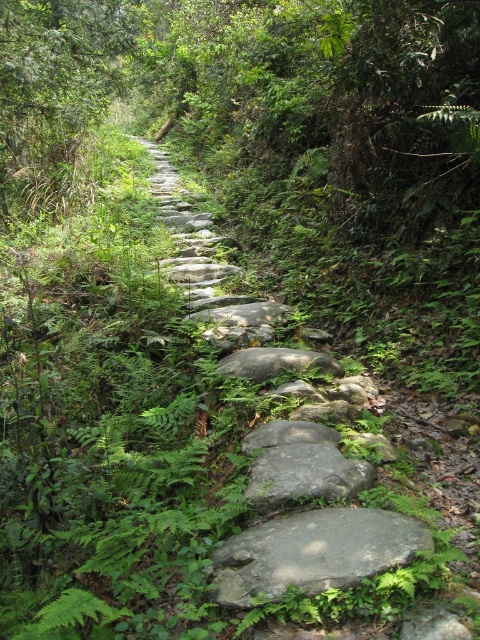
You are hiking along a forest path and come across two gray smooth rocks at the center of the path. One is labeled as the gray smooth rock at center and the other as the gray smooth stone at center. Which one is positioned to the left when viewed from your perspective standing at the start of the path?

The gray smooth rock at center is positioned to the left of the gray smooth stone at center.

You are standing on the forest path and want to reach the point at coordinates point (298, 497). Given that your average walking speed is 1.5 meters per second, how many seconds will it take you to reach the point?

The point (298, 497) is 3.37 meters away from the viewer. At a walking speed of 1.5 meters per second, it would take approximately 2.25 seconds to reach the point.